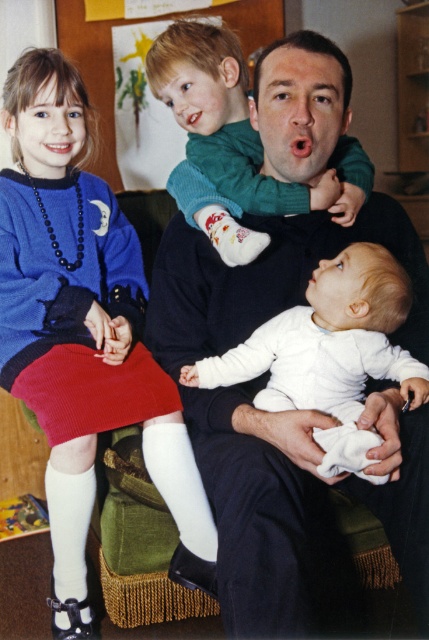
You are a tailor who needs to determine which item requires more fabric to make between the knitted blue sweater at upper left and the white smooth onesie at lower center. Based on their sizes, which one would need more fabric?

The knitted blue sweater at upper left is bigger than the white smooth onesie at lower center, so it would require more fabric to make.